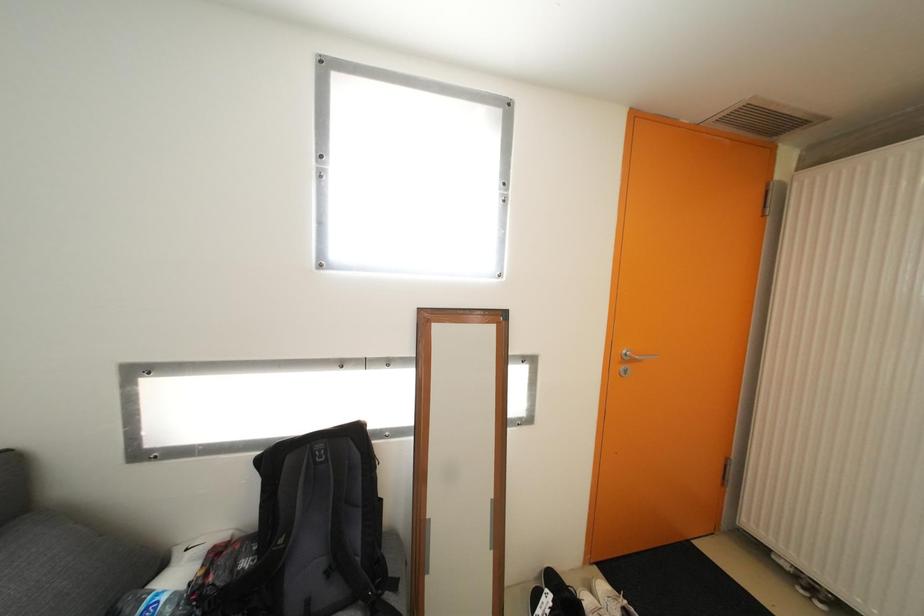
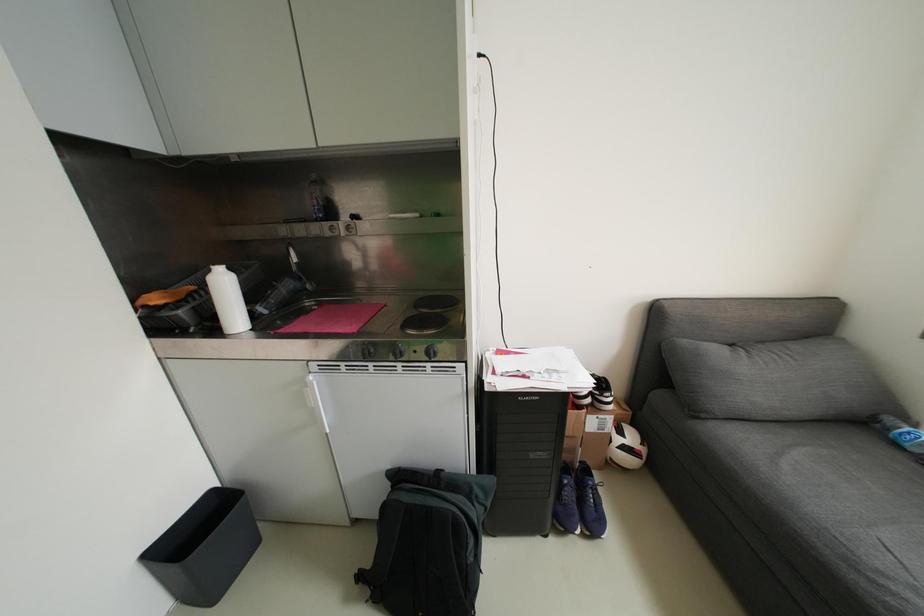
Based on the continuous images, in which direction is the camera rotating?

The camera's rotation is toward left-down.